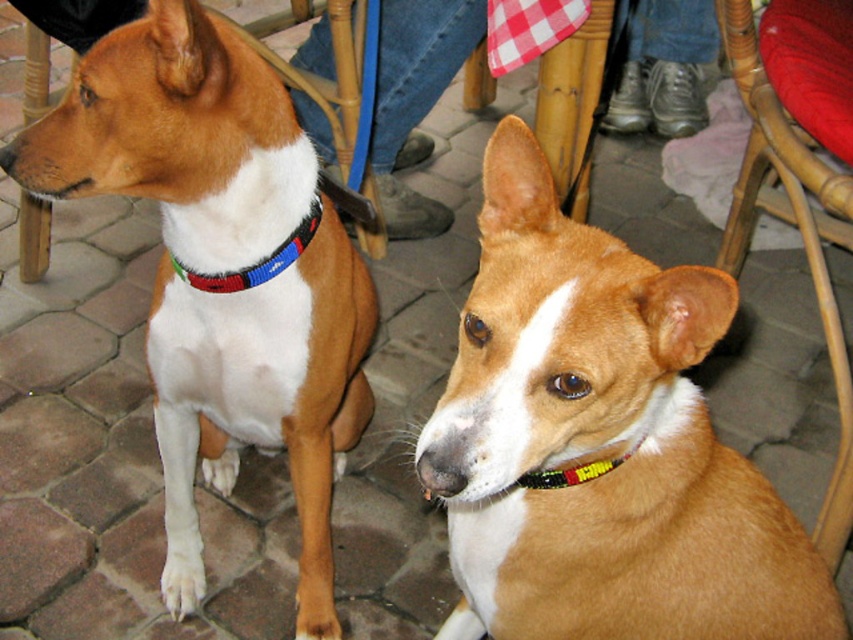
Who is shorter, woven wood chair at lower right or multicolored beaded collar at center?

With less height is multicolored beaded collar at center.

Which is behind, point (743, 179) or point (288, 259)?

The point (743, 179) is more distant.

Does point (820, 232) come behind point (202, 285)?

Yes, point (820, 232) is behind point (202, 285).

Find the location of a particular element. The width and height of the screenshot is (853, 640). woven wood chair at lower right is located at coordinates (798, 230).

Does point (277, 61) come farther from viewer compared to point (230, 273)?

Yes, point (277, 61) is behind point (230, 273).

Can you confirm if wooden chair at left is taller than multicolored beaded collar at center?

Indeed, wooden chair at left has a greater height compared to multicolored beaded collar at center.

Is point (41, 216) farther from viewer compared to point (297, 240)?

Yes, point (41, 216) is behind point (297, 240).

Where is `wooden chair at left`? wooden chair at left is located at coordinates (325, 81).

Which is in front, point (675, 362) or point (840, 547)?

Positioned in front is point (675, 362).

Locate an element on the screen. brown shiny dog at center is located at coordinates pyautogui.click(x=601, y=444).